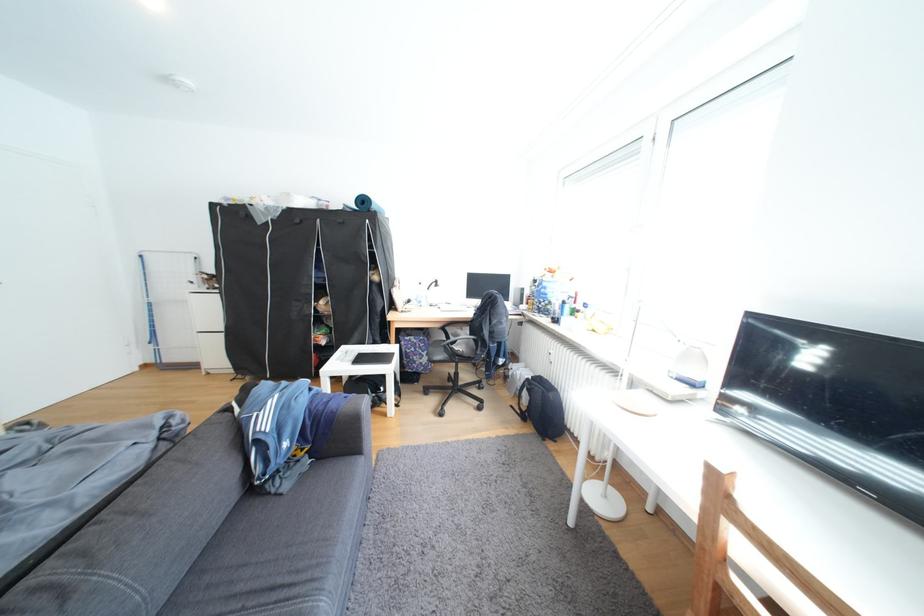
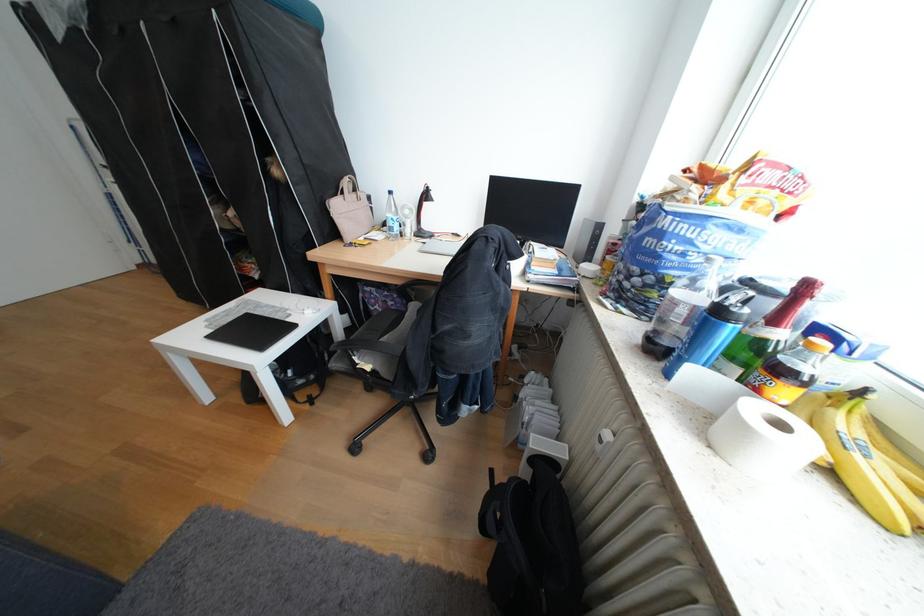
Question: In a continuous first-person perspective shot, in which direction is the camera moving?

Choices:
 (A) Left
 (B) Right
 (C) Forward
 (D) Backward

Answer: (C)